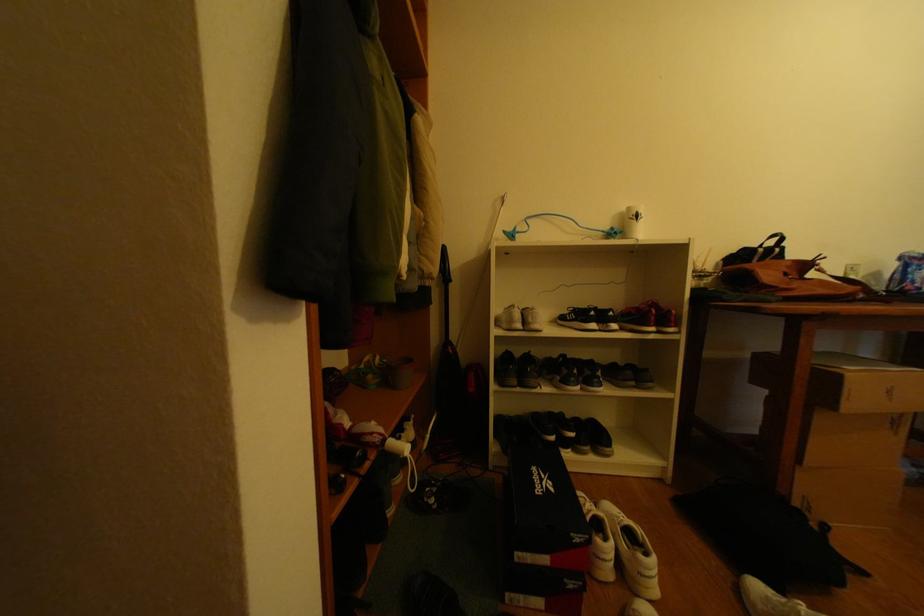
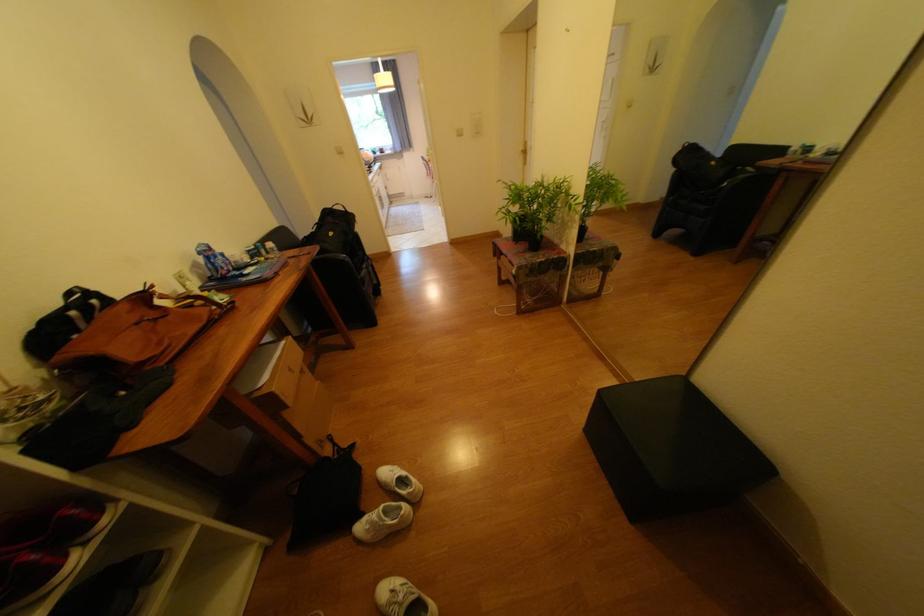
The first image is from the beginning of the video and the second image is from the end. How did the camera likely rotate when shooting the video?

The rotation direction of the camera is right-down.